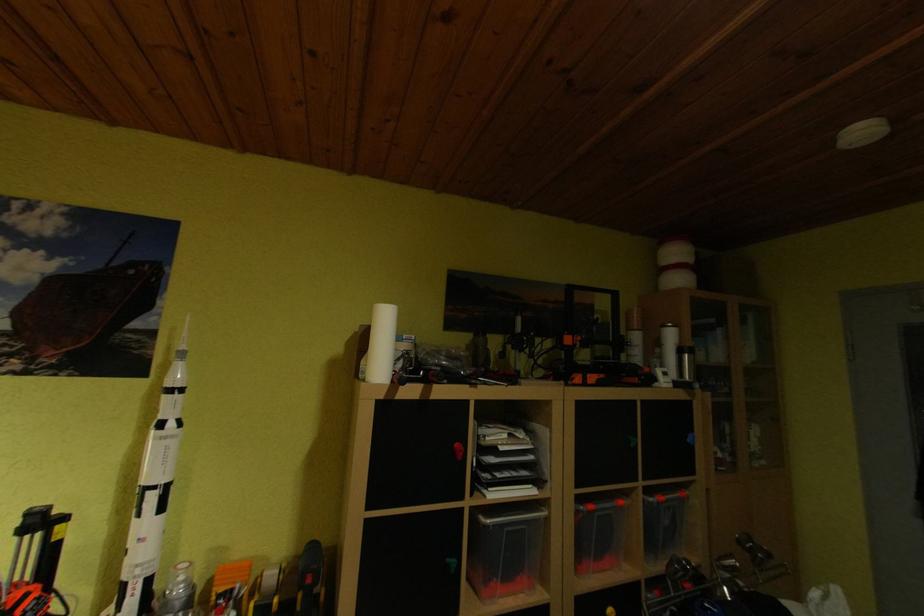
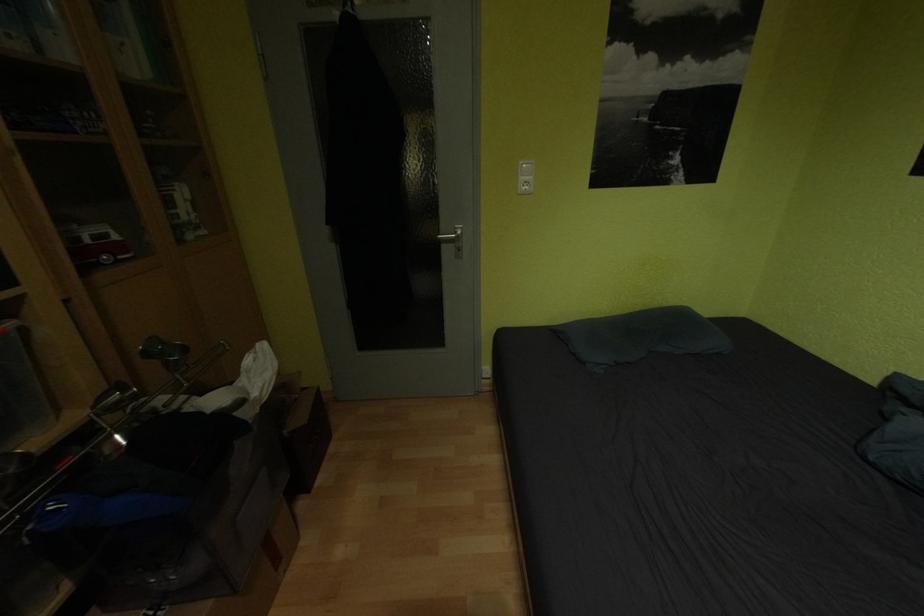
Based on the continuous images, in which direction is the camera rotating?

The rotation direction of the camera is right-down.